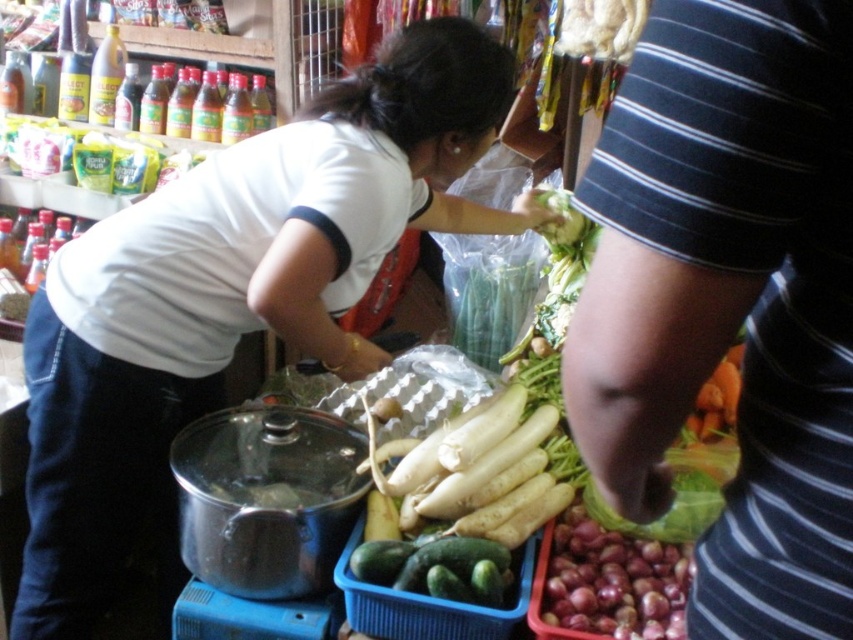
Who is positioned more to the right, striped fabric arm at right or smooth purple onion at lower right?

smooth purple onion at lower right is more to the right.

Which is below, striped fabric arm at right or smooth purple onion at lower right?

smooth purple onion at lower right is lower down.

Find the location of a particular element. Image resolution: width=853 pixels, height=640 pixels. striped fabric arm at right is located at coordinates (729, 298).

Find the location of a particular element. Image resolution: width=853 pixels, height=640 pixels. striped fabric arm at right is located at coordinates (729, 298).

Which is below, striped fabric arm at right or white matte radish at center?

white matte radish at center is lower down.

Does striped fabric arm at right have a greater width compared to white matte radish at center?

In fact, striped fabric arm at right might be narrower than white matte radish at center.

Which is in front, point (809, 125) or point (540, 472)?

Point (809, 125) is more forward.

The height and width of the screenshot is (640, 853). What are the coordinates of `striped fabric arm at right` in the screenshot? It's located at (729, 298).

Is smooth purple onion at lower right positioned in front of green matte cucumber at center?

Yes, it is in front of green matte cucumber at center.

Is point (538, 620) positioned before point (461, 589)?

Yes.

Identify the location of smooth purple onion at lower right. (605, 582).